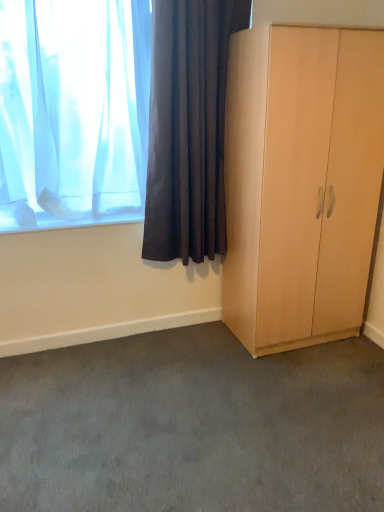
Question: Is translucent fabric curtain at upper left, positioned as the 1th curtain in left-to-right order, inside the boundaries of gray carpet at lower center, or outside?

Choices:
 (A) inside
 (B) outside

Answer: (B)

Question: Considering the positions of translucent fabric curtain at upper left, positioned as the 1th curtain in left-to-right order, and gray carpet at lower center in the image, is translucent fabric curtain at upper left, positioned as the 1th curtain in left-to-right order, wider or thinner than gray carpet at lower center?

Choices:
 (A) thin
 (B) wide

Answer: (A)

Question: Which object is positioned farthest from the dark fabric curtain at upper left, which appears as the first curtain when viewed from the right?

Choices:
 (A) light wood wardrobe at right
 (B) gray carpet at lower center
 (C) translucent fabric curtain at upper left, positioned as the 1th curtain in left-to-right order

Answer: (B)

Question: Estimate the real-world distances between objects in this image. Which object is closer to the translucent fabric curtain at upper left, which is the 2th curtain in right-to-left order?

Choices:
 (A) light wood wardrobe at right
 (B) gray carpet at lower center
 (C) dark fabric curtain at upper left, the second curtain in the left-to-right sequence

Answer: (C)